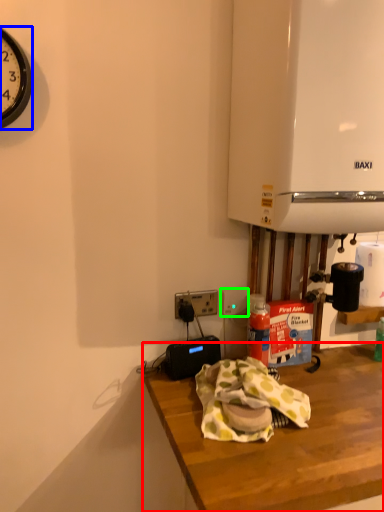
Question: Considering the real-world distances, which object is closest to desk (highlighted by a red box)? clock (highlighted by a blue box) or electric outlet (highlighted by a green box).

Choices:
 (A) clock
 (B) electric outlet

Answer: (B)